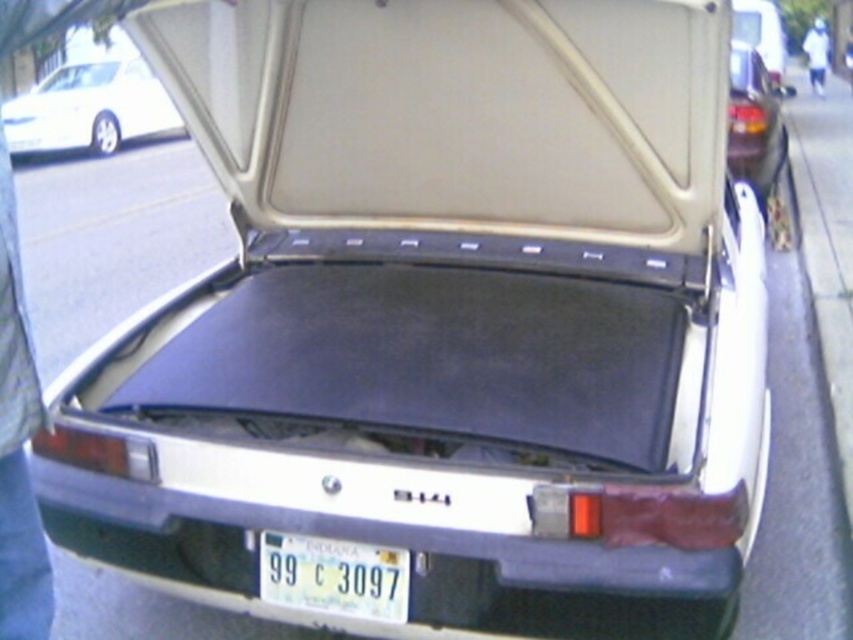
Question: Is white matte car at upper left to the right of black matte trunk at upper right from the viewer's perspective?

Choices:
 (A) yes
 (B) no

Answer: (B)

Question: Does white plastic license plate at lower center appear on the left side of black matte trunk at upper right?

Choices:
 (A) yes
 (B) no

Answer: (A)

Question: Which of the following is the farthest from the observer?

Choices:
 (A) (115, 129)
 (B) (759, 68)
 (C) (283, 538)

Answer: (A)

Question: Which point is farther to the camera?

Choices:
 (A) black matte trunk at upper right
 (B) white plastic license plate at lower center
 (C) white matte car at upper left

Answer: (C)

Question: Which of the following is the closest to the observer?

Choices:
 (A) (759, 195)
 (B) (32, 100)

Answer: (A)

Question: Is white plastic license plate at lower center in front of black matte trunk at upper right?

Choices:
 (A) no
 (B) yes

Answer: (B)